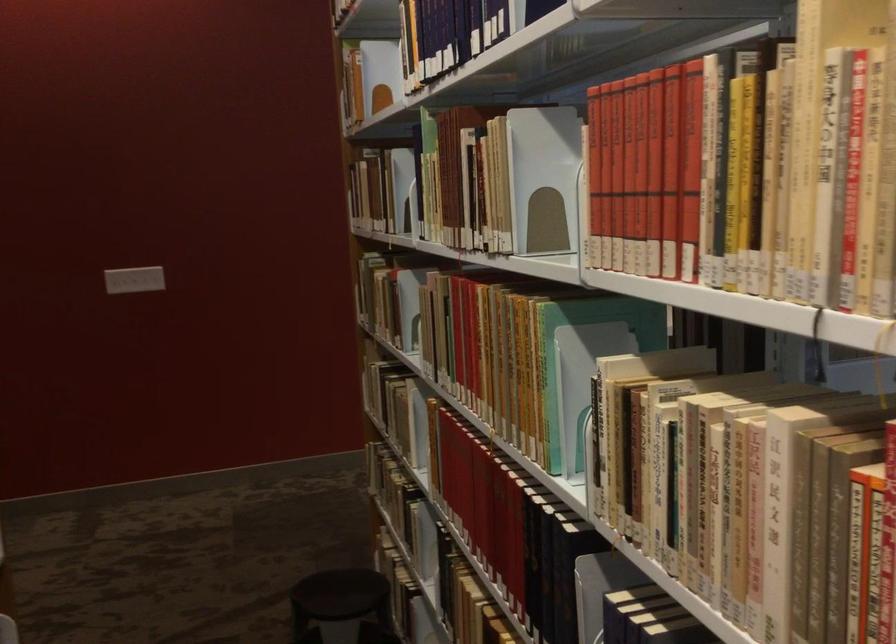
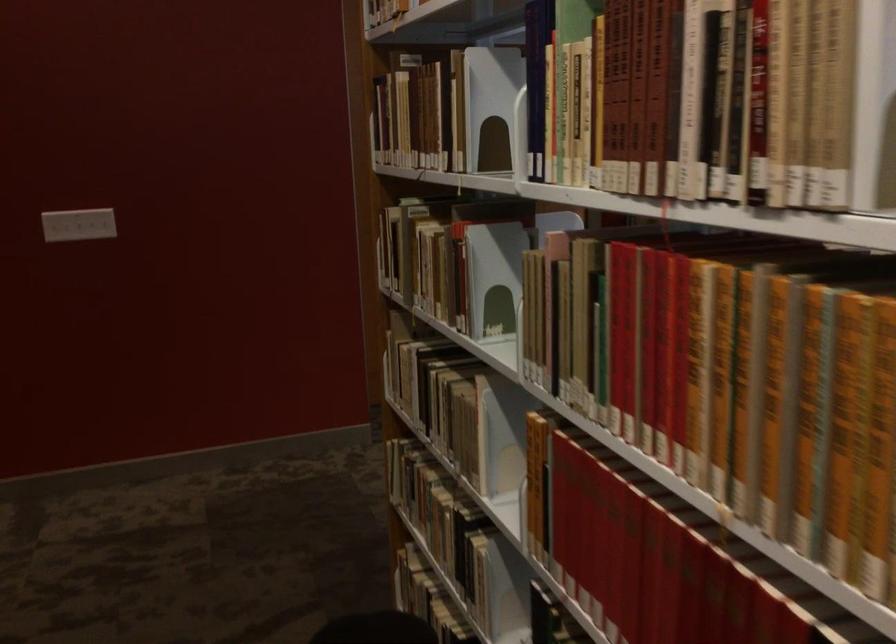
What movement of the cameraman would produce the second image?

The cameraman moved toward left, forward.